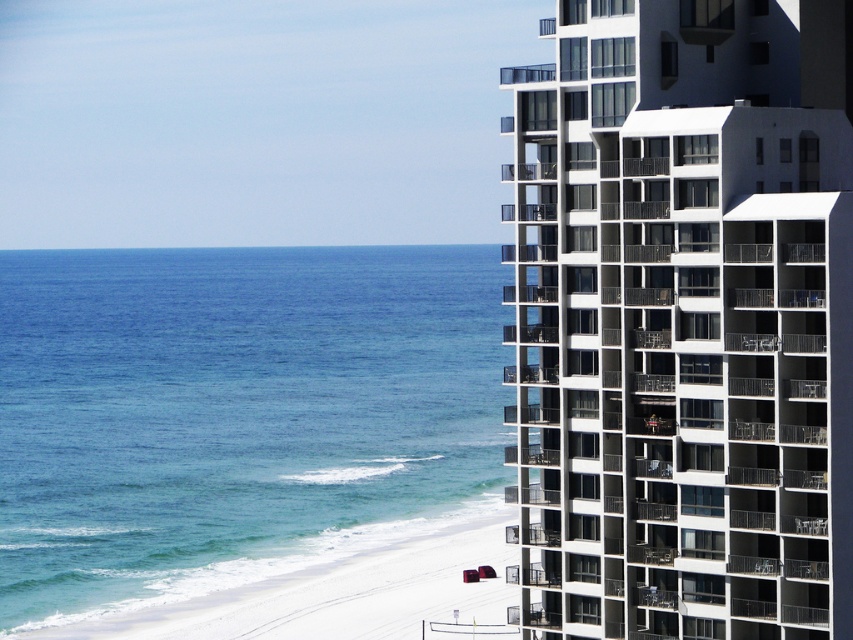
In the scene shown: You are standing at the point marked by the coordinates point (231,412) in the coastal scene. Based on the image description, what is the immediate environment around this point?

The point (231,412) corresponds to blue water at lower left, so the immediate environment around this point is blue water at lower left.

You are standing on the beach looking towards the ocean. You see the white glass building at right and the blue water at lower left. Which object is positioned more to the east if the sun is setting in the west?

The blue water at lower left is positioned more to the east because it is to the left of the white glass building at right, and since the sun is setting in the west, the eastern side would be on the left side of the image.

You are standing at the center of the image. Which direction should you look to see the white glass building at right?

The white glass building at right is located at the right side of the image, so you should look to your right to see it.